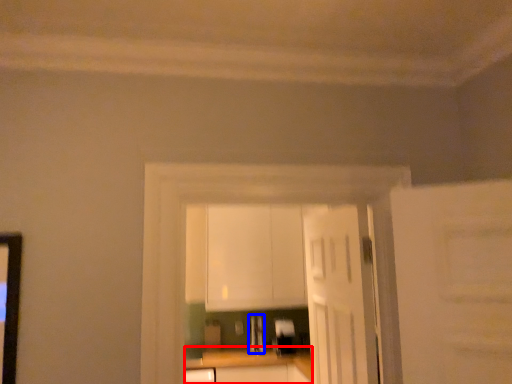
Question: Which of the following is the farthest to the observer, counter top (highlighted by a red box) or appliance (highlighted by a blue box)?

Choices:
 (A) counter top
 (B) appliance

Answer: (B)